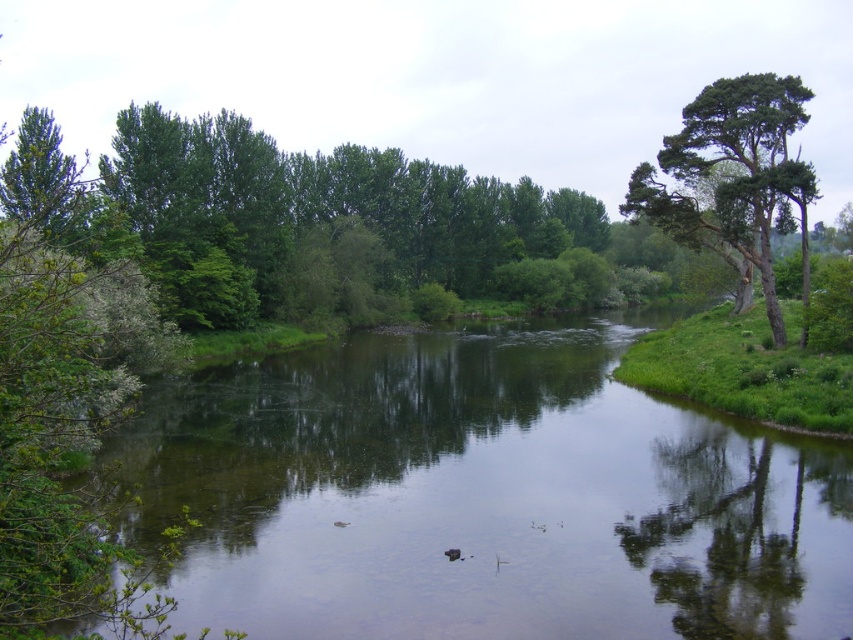
Question: Is green smooth water at center thinner than green rough bark tree at upper right?

Choices:
 (A) yes
 (B) no

Answer: (B)

Question: Which point appears farthest from the camera in this image?

Choices:
 (A) (741, 116)
 (B) (299, 442)

Answer: (A)

Question: Which of the following is the farthest from the observer?

Choices:
 (A) green rough bark tree at upper right
 (B) green smooth water at center

Answer: (A)

Question: Which of the following is the farthest from the observer?

Choices:
 (A) green rough bark tree at upper right
 (B) green smooth water at center

Answer: (A)

Question: Is green smooth water at center smaller than green rough bark tree at upper right?

Choices:
 (A) no
 (B) yes

Answer: (B)

Question: Does green smooth water at center appear under green rough bark tree at upper right?

Choices:
 (A) yes
 (B) no

Answer: (A)